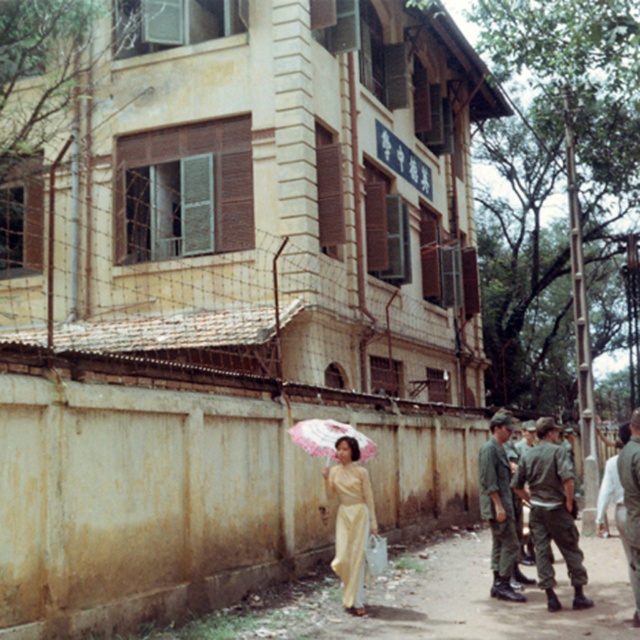
You are standing in front of the building and want to reach the point marked as point (509, 513). However, there is an obstacle at point (637, 624). Can you walk directly to your destination without going around the obstacle?

Point (509, 513) is behind point (637, 624), so you cannot walk directly to your destination without going around the obstacle.

You are a security guard assigned to patrol the restricted area in front of the building with brown shutters. You notice a point marked at coordinates (499, 506). What object is located at that point?

The point at coordinates 0.790, 0.780 indicates a green military uniform at center.

You are a security guard standing in front of the building. You need to check which uniform is closer to the right side of the image. Which one is positioned more to the right between the camouflage fabric uniform at center and the green military uniform at center?

The camouflage fabric uniform at center is positioned to the right of the green military uniform at center, so the camouflage fabric uniform at center is more to the right.